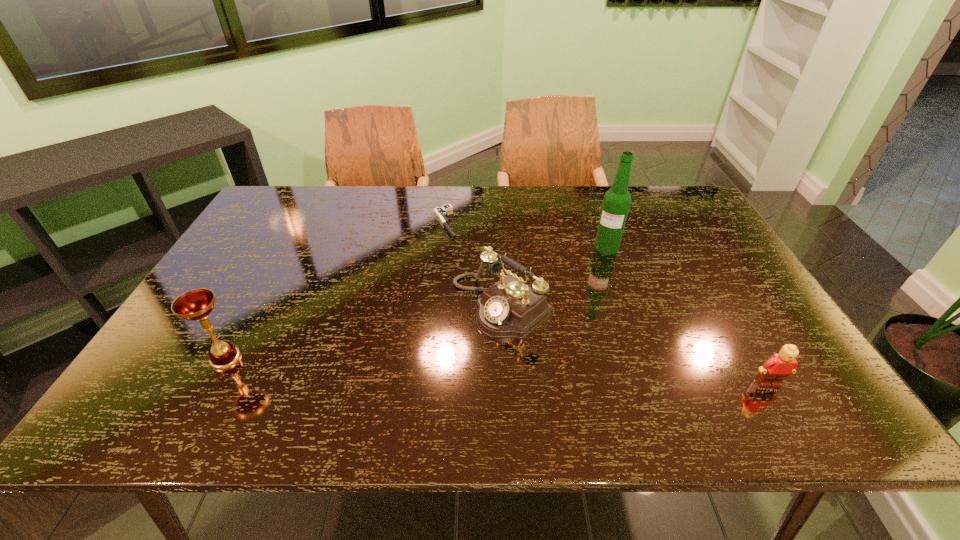
The width and height of the screenshot is (960, 540). Identify the location of chalice. (197, 304).

Find the location of a particular element. The image size is (960, 540). the leftmost object is located at coordinates (197, 304).

Identify the location of the rightmost object. Image resolution: width=960 pixels, height=540 pixels. (780, 365).

You are a GUI agent. You are given a task and a screenshot of the screen. Output one action in this format:
    pyautogui.click(x=<x>, y=<y>)
    Task: Click on the nearest object
    
    Given the screenshot: What is the action you would take?
    pyautogui.click(x=780, y=365)

Where is `beer bottle`? The image size is (960, 540). beer bottle is located at coordinates (617, 200).

Find the location of a particular element. This screenshot has height=540, width=960. the second farthest object is located at coordinates (617, 200).

This screenshot has height=540, width=960. Identify the location of telephone. (510, 308).

Where is `pistol`? pistol is located at coordinates (441, 212).

Locate an element on the screen. Image resolution: width=960 pixels, height=540 pixels. the farthest object is located at coordinates (441, 212).

Locate an element on the screen. This screenshot has width=960, height=540. vacant area situated on the left of the leftmost object is located at coordinates (178, 359).